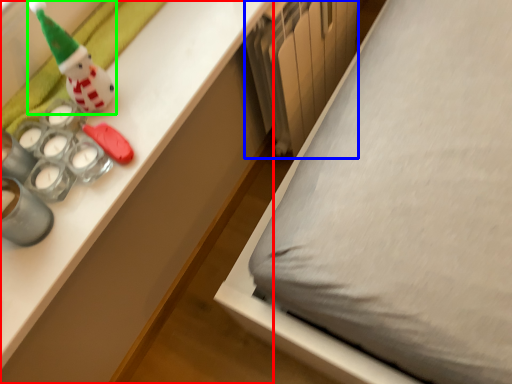
Question: Which object is the farthest from desk (highlighted by a red box)? Choose among these: radiator (highlighted by a blue box) or toy (highlighted by a green box).

Choices:
 (A) radiator
 (B) toy

Answer: (B)